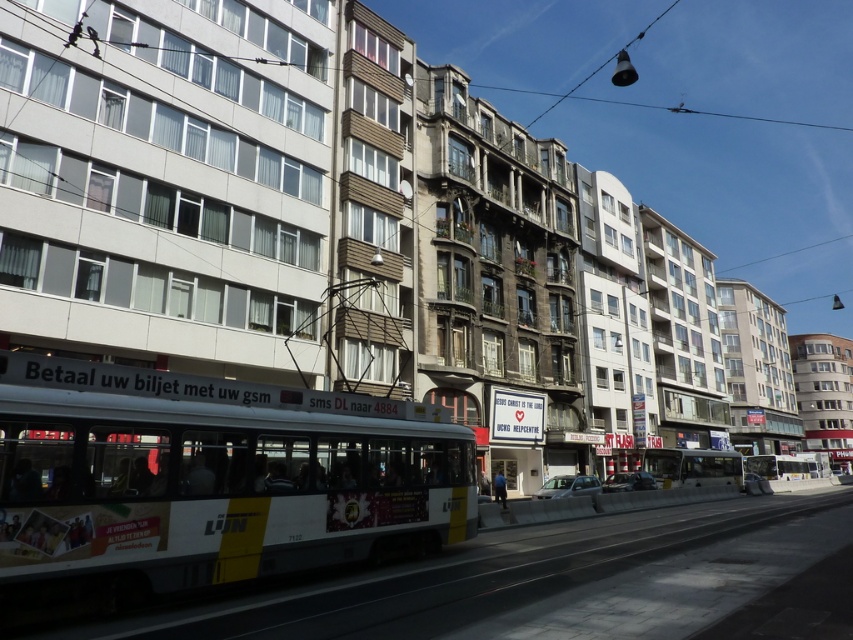
Question: Which point is farther to the camera?

Choices:
 (A) white metallic bus at center
 (B) white glossy bus at center
 (C) yellow metallic bus at center

Answer: (C)

Question: Which point is farther to the camera?

Choices:
 (A) (0, 568)
 (B) (778, 474)
 (C) (680, 461)

Answer: (B)

Question: Can you confirm if white glossy bus at center is positioned below yellow metallic bus at center?

Choices:
 (A) yes
 (B) no

Answer: (B)

Question: Considering the real-world distances, which object is closest to the yellow metallic bus at center?

Choices:
 (A) white glossy bus at center
 (B) white metallic bus at center

Answer: (B)

Question: Can you confirm if white glossy bus at center is smaller than white metallic bus at center?

Choices:
 (A) no
 (B) yes

Answer: (B)

Question: Can you confirm if white glossy bus at center is smaller than yellow metallic bus at center?

Choices:
 (A) yes
 (B) no

Answer: (A)